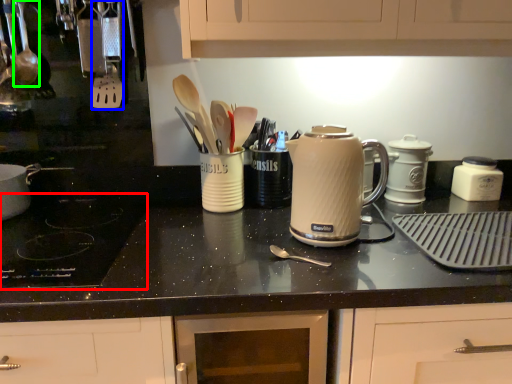
Question: Which object is positioned farthest from gas stove (highlighted by a red box)? Select from silverware (highlighted by a blue box) and utensil (highlighted by a green box).

Choices:
 (A) silverware
 (B) utensil

Answer: (B)